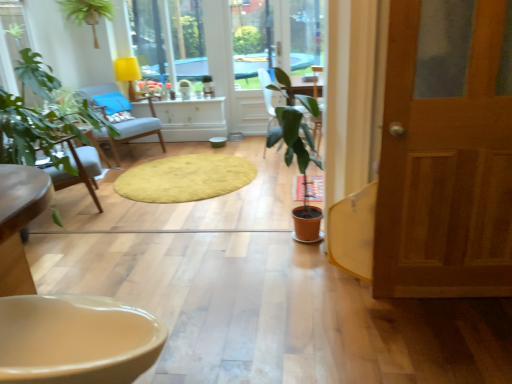
Question: Is point (78, 23) positioned closer to the camera than point (147, 119)?

Choices:
 (A) closer
 (B) farther

Answer: (B)

Question: From the image's perspective, is green matte plant at upper left, the second houseplant from the right, above or below light blue fabric chair at center?

Choices:
 (A) above
 (B) below

Answer: (A)

Question: Which object is positioned farthest from the yellow fabric lampshade at upper center?

Choices:
 (A) green matte plant at center, the second houseplant positioned from the top
 (B) wooden door at right
 (C) green matte plant at upper left, acting as the first houseplant starting from the left
 (D) light blue fabric chair at center
 (E) yellow soft rug at center

Answer: (B)

Question: Estimate the real-world distances between objects in this image. Which object is closer to the green matte plant at upper left, the 2th houseplant from the front?

Choices:
 (A) wooden door at right
 (B) yellow fabric lampshade at upper center
 (C) yellow soft rug at center
 (D) beige glossy sink at lower left
 (E) light blue fabric chair at center

Answer: (B)